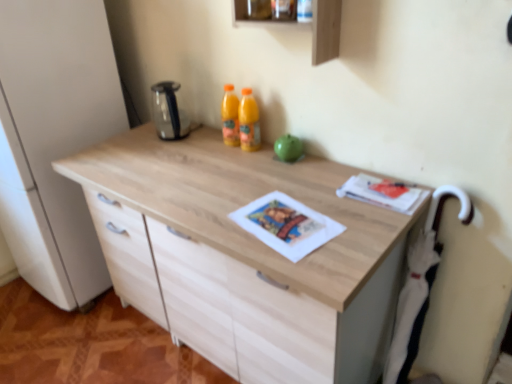
Question: Considering the relative positions of matte paper magazine at upper right and wooden shelf at upper center, the second shelf when ordered from top to bottom, in the image provided, is matte paper magazine at upper right to the left or to the right of wooden shelf at upper center, the second shelf when ordered from top to bottom,?

Choices:
 (A) right
 (B) left

Answer: (A)

Question: In the image, is matte paper magazine at upper right positioned in front of or behind wooden shelf at upper center, acting as the 1th shelf starting from the bottom?

Choices:
 (A) front
 (B) behind

Answer: (A)

Question: Considering the real-world distances, which object is closest to the matte paper magazine at upper right?

Choices:
 (A) stainless steel kettle at upper center
 (B) wooden shelf at upper center, the second shelf when ordered from top to bottom
 (C) wooden frame at upper center, marked as the first shelf in a top-to-bottom arrangement

Answer: (B)

Question: Estimate the real-world distances between objects in this image. Which object is closer to the matte paper magazine at upper right?

Choices:
 (A) wooden frame at upper center, positioned as the 2th shelf in bottom-to-top order
 (B) stainless steel kettle at upper center
 (C) wooden shelf at upper center, acting as the 1th shelf starting from the bottom

Answer: (C)